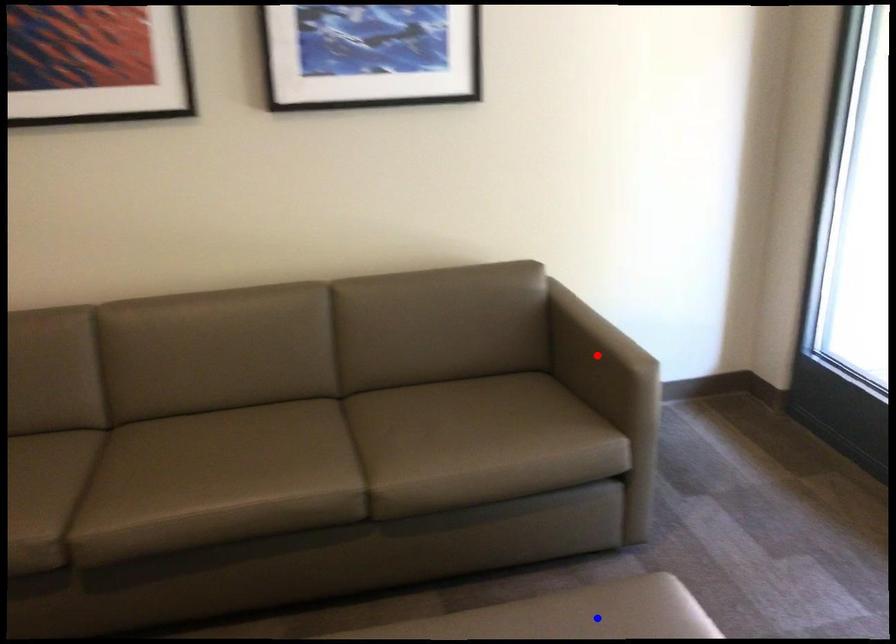
Question: Two points are marked on the image. Which point is closer to the camera?

Choices:
 (A) Blue point is closer.
 (B) Red point is closer.

Answer: (A)